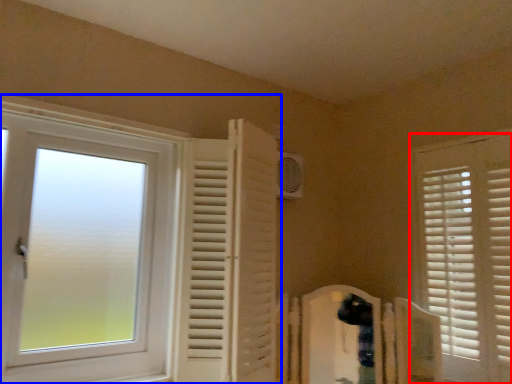
Question: Which of the following is the farthest to the observer, window (highlighted by a red box) or window (highlighted by a blue box)?

Choices:
 (A) window
 (B) window

Answer: (A)